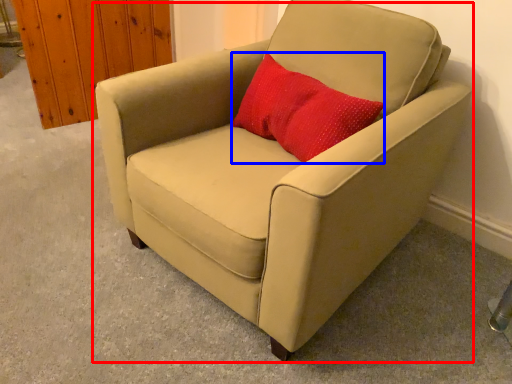
Question: Which object is further to the camera taking this photo, chair (highlighted by a red box) or throw pillow (highlighted by a blue box)?

Choices:
 (A) chair
 (B) throw pillow

Answer: (B)